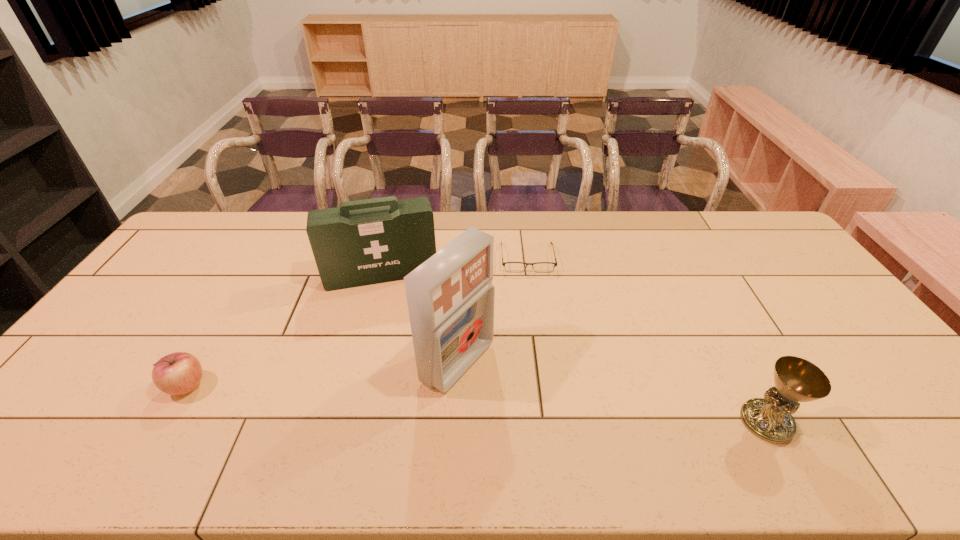
The width and height of the screenshot is (960, 540). In order to click on vacant space on the desktop that is between the leftmost object and the chalice and is positioned on the front-facing side of the fourth shortest object in this screenshot , I will do `click(396, 399)`.

The width and height of the screenshot is (960, 540). Identify the location of vacant space on the desktop that is between the fourth tallest object and the rightmost object and is positioned on the front-facing side of the spectacles. (543, 408).

You are a GUI agent. You are given a task and a screenshot of the screen. Output one action in this format:
    pyautogui.click(x=<x>, y=<y>)
    Task: Click on the vacant space on the desktop that is between the second shortest object and the rightmost object and is positioned on the front-facing side of the taller first-aid kit
    The height and width of the screenshot is (540, 960).
    Given the screenshot: What is the action you would take?
    pyautogui.click(x=532, y=407)